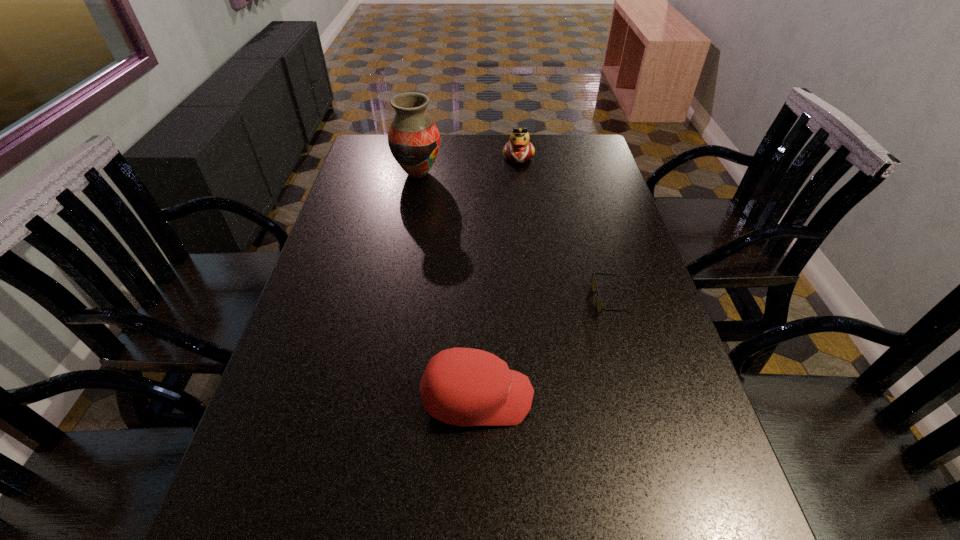
Identify the location of the tallest object. This screenshot has width=960, height=540. (414, 140).

Find the location of a particular element. the leftmost object is located at coordinates tap(414, 140).

The height and width of the screenshot is (540, 960). Find the location of `duck`. duck is located at coordinates (518, 149).

Locate an element on the screen. This screenshot has width=960, height=540. the nearest object is located at coordinates (465, 387).

The image size is (960, 540). In order to click on the third tallest object in this screenshot , I will do `click(465, 387)`.

Image resolution: width=960 pixels, height=540 pixels. Identify the location of the third farthest object. (599, 305).

Where is `the shortest object`? The image size is (960, 540). the shortest object is located at coordinates (599, 305).

Find the location of a particular element. Image resolution: width=960 pixels, height=540 pixels. vacant position located 0.150m on the right of the tallest object is located at coordinates (486, 173).

Find the location of `vacant space situated on the face of the duck`. vacant space situated on the face of the duck is located at coordinates (528, 232).

Where is `vacant area situated 0.180m on the front-facing side of the second shortest object`? The image size is (960, 540). vacant area situated 0.180m on the front-facing side of the second shortest object is located at coordinates (619, 397).